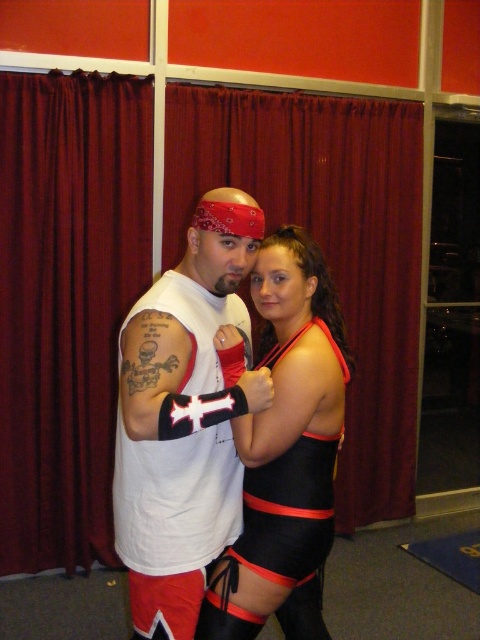
Consider the image. You are a photographer trying to capture a closeup of the wrestler on the left. You notice two points marked in the image at coordinates point (155, 433) and point (311, 557). Which point should you focus on to ensure the wrestler on the left is in focus?

Point (155, 433) is closer to the camera than point (311, 557), so focusing on point (155, 433) will ensure the wrestler on the left is in focus.

You are a photographer standing in front of the wrestlers. You notice the white matte tank top at center and the black matte wrestling outfit at center. Which one do you see first when looking at the image?

The white matte tank top at center is closer to the viewer than the black matte wrestling outfit at center, so you see the white matte tank top at center first.

You are a photographer setting up a shoot in the room with the red velvet curtain at center and the white matte tank top at center. You need to ensure that the larger object is placed behind the smaller one for the best lighting. Which object should be positioned behind the other?

The red velvet curtain at center is larger than the white matte tank top at center, so it should be placed behind the smaller object for optimal lighting.